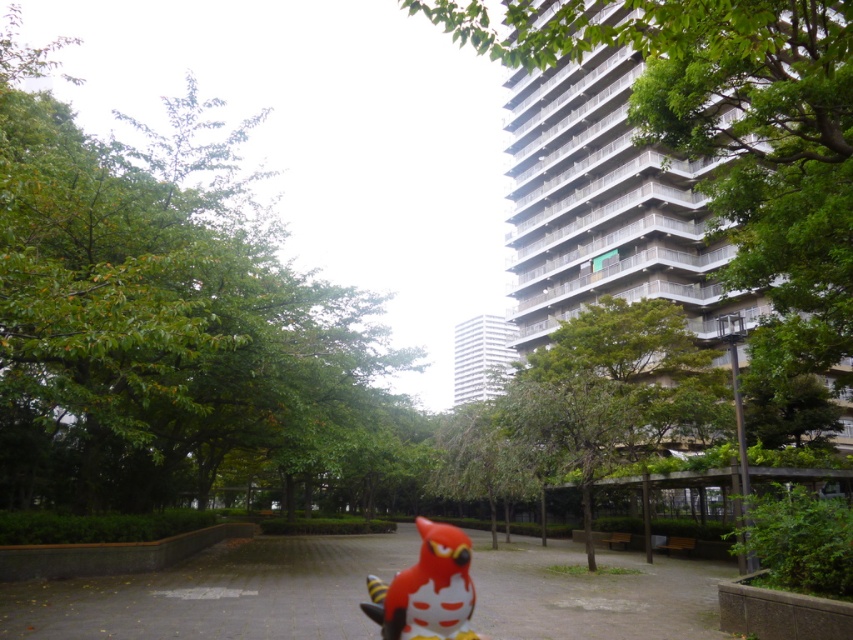
Question: Considering the relative positions of green leafy tree at upper left and matte red bird at center in the image provided, where is green leafy tree at upper left located with respect to matte red bird at center?

Choices:
 (A) left
 (B) right

Answer: (A)

Question: Which point is closer to the camera taking this photo?

Choices:
 (A) (408, 572)
 (B) (166, 250)
 (C) (764, 129)

Answer: (A)

Question: Estimate the real-world distances between objects in this image. Which object is farther from the green leafy tree at upper left?

Choices:
 (A) matte red bird at center
 (B) green leafy tree at upper right

Answer: (B)

Question: Is green leafy tree at upper left smaller than matte red bird at center?

Choices:
 (A) yes
 (B) no

Answer: (B)

Question: Is green leafy tree at upper right wider than matte red bird at center?

Choices:
 (A) no
 (B) yes

Answer: (B)

Question: Which point is closer to the camera?

Choices:
 (A) (757, 163)
 (B) (4, 90)
 (C) (453, 529)

Answer: (C)